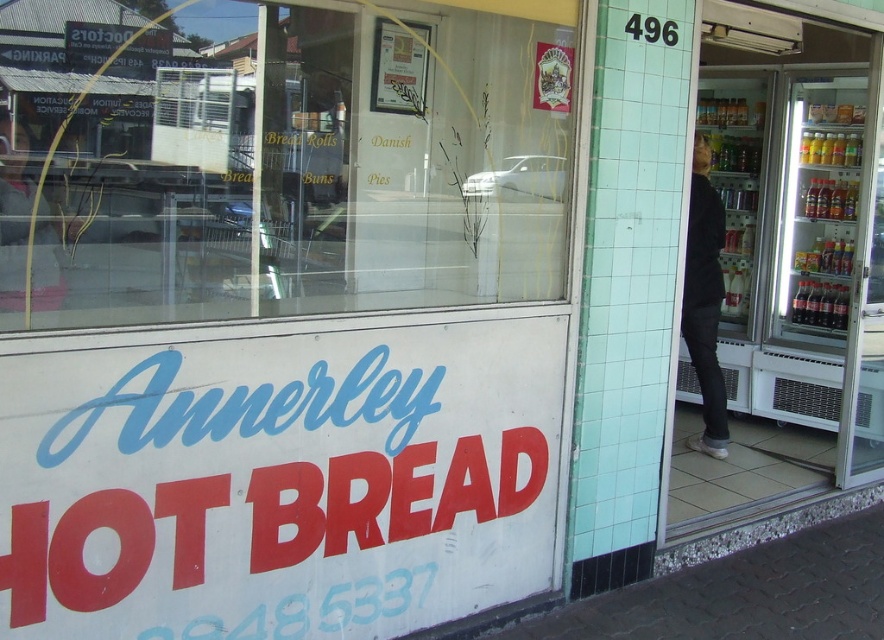
Question: Which is nearer to the transparent glass at center?

Choices:
 (A) transparent glass door at right
 (B) matte black jacket at left
 (C) black matte jacket at right

Answer: (B)

Question: Does transparent glass at center appear under matte black jacket at left?

Choices:
 (A) no
 (B) yes

Answer: (A)

Question: Which object is farther from the camera taking this photo?

Choices:
 (A) black matte jacket at right
 (B) matte black jacket at left
 (C) transparent glass at center

Answer: (A)

Question: Is transparent glass at center below matte black jacket at left?

Choices:
 (A) yes
 (B) no

Answer: (B)

Question: Among these objects, which one is nearest to the camera?

Choices:
 (A) black matte jacket at right
 (B) transparent glass at center
 (C) transparent glass door at right

Answer: (B)

Question: Does transparent glass at center appear on the right side of black matte jacket at right?

Choices:
 (A) no
 (B) yes

Answer: (A)